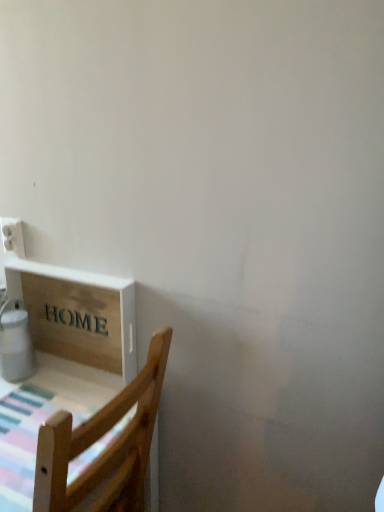
Where is `blank space above wooden sign at lower left (from a real-world perspective)`? This screenshot has width=384, height=512. blank space above wooden sign at lower left (from a real-world perspective) is located at coordinates (68, 269).